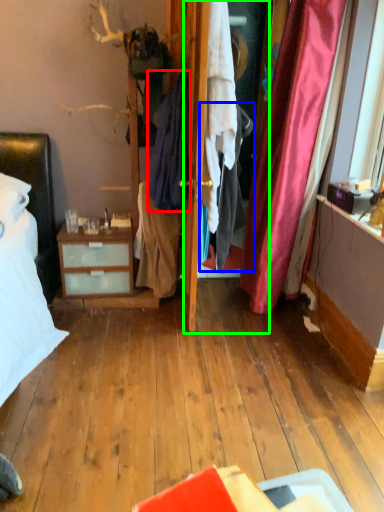
Question: Considering the real-world distances, which object is closest to clothing (highlighted by a red box)? clothing (highlighted by a blue box) or screen door (highlighted by a green box).

Choices:
 (A) clothing
 (B) screen door

Answer: (B)